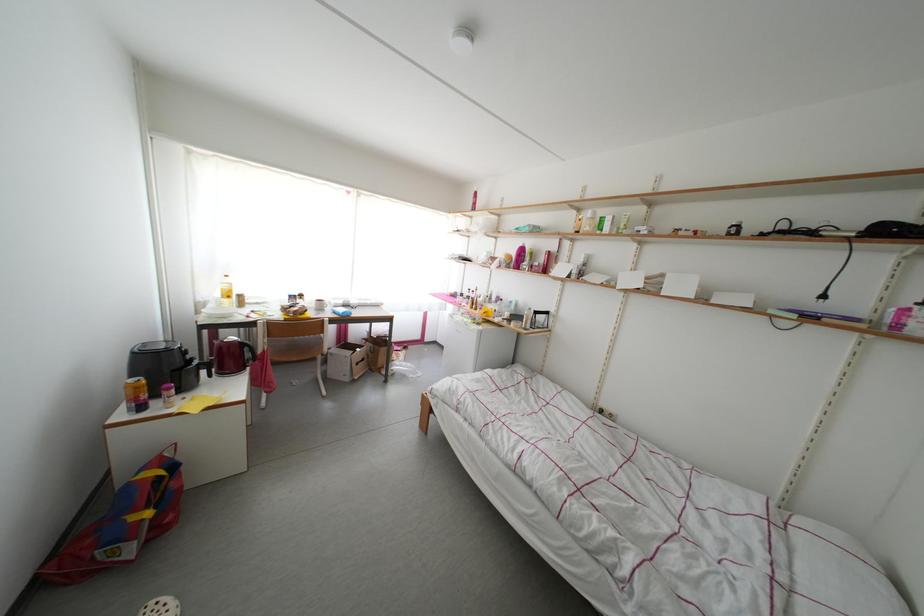
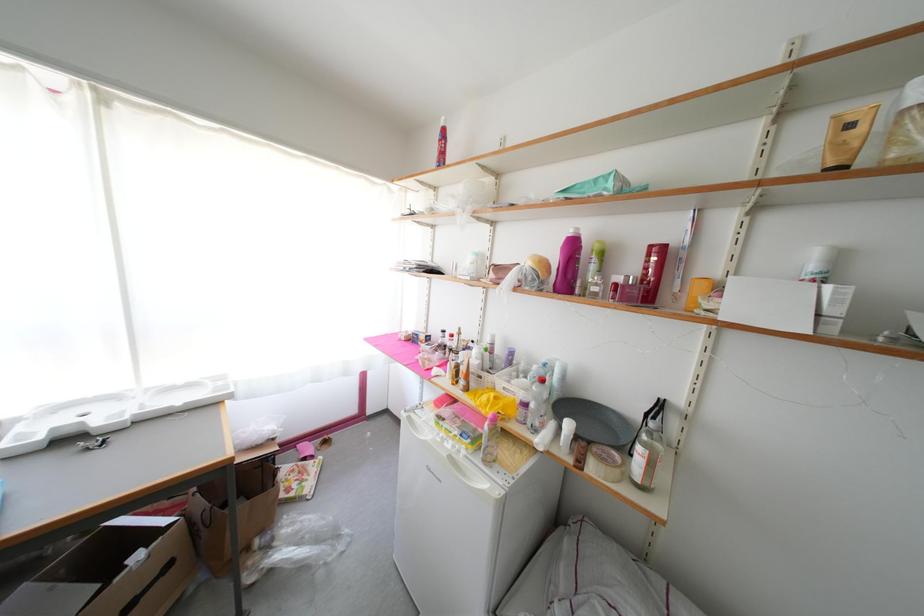
Question: The images are taken continuously from a first-person perspective. In which direction are you moving?

Choices:
 (A) Left
 (B) Right
 (C) Forward
 (D) Backward

Answer: (C)